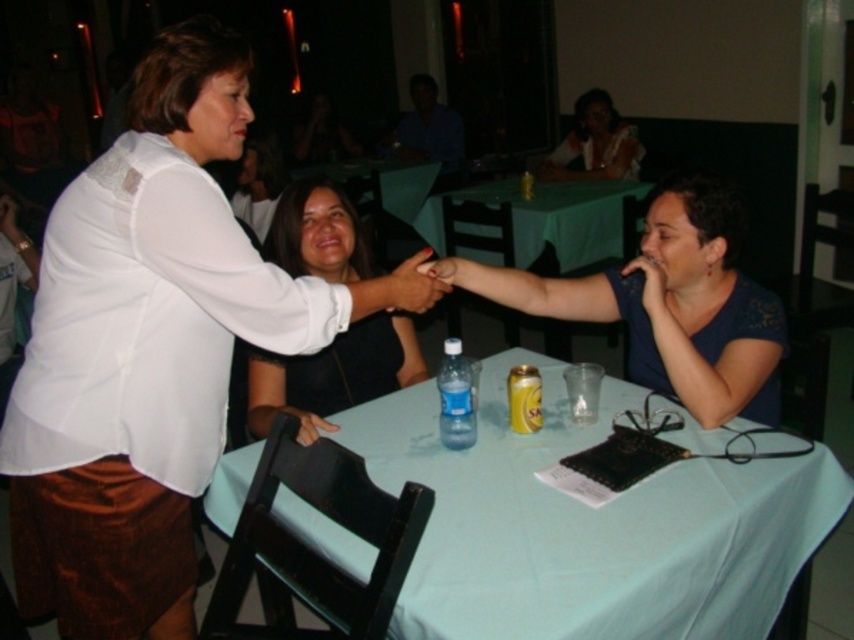
Which of these two, black matte dress at center or green fabric table at center, stands taller?

black matte dress at center

Is black matte dress at center shorter than green fabric table at center?

Incorrect, black matte dress at center's height does not fall short of green fabric table at center's.

I want to click on black matte dress at center, so click(x=334, y=374).

The image size is (854, 640). What are the coordinates of `blue shirt at upper center` in the screenshot? It's located at (428, 128).

Is point (418, 134) closer to camera compared to point (279, 172)?

No, it is behind (279, 172).

Locate an element on the screen. blue shirt at upper center is located at coordinates (428, 128).

At what (x,y) coordinates should I click in order to perform the action: click on blue shirt at upper center. Please return your answer as a coordinate pair (x, y). The width and height of the screenshot is (854, 640). Looking at the image, I should click on (428, 128).

Can you confirm if green fabric table at center is positioned to the left of matte black hand at center?

In fact, green fabric table at center is to the right of matte black hand at center.

Does green fabric table at center have a larger size compared to matte black hand at center?

Correct, green fabric table at center is larger in size than matte black hand at center.

The height and width of the screenshot is (640, 854). I want to click on green fabric table at center, so click(535, 221).

Identify the location of green fabric table at center. The width and height of the screenshot is (854, 640). (535, 221).